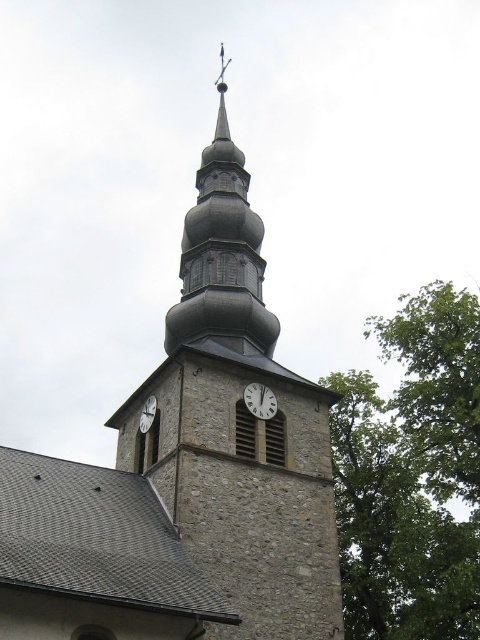
Question: Is stone clock tower at center below green leafy tree at upper right?

Choices:
 (A) yes
 (B) no

Answer: (B)

Question: Observing the image, what is the correct spatial positioning of green leafy tree at upper right in reference to white glossy clock at center?

Choices:
 (A) right
 (B) left

Answer: (A)

Question: Which of the following is the closest to the observer?

Choices:
 (A) stone clock tower at center
 (B) white matte clock at center

Answer: (A)

Question: Which object is the closest to the stone clock tower at center?

Choices:
 (A) green leafy tree at upper right
 (B) white glossy clock at center

Answer: (B)

Question: Which object appears closest to the camera in this image?

Choices:
 (A) white matte clock at center
 (B) green leafy tree at upper right
 (C) white glossy clock at center
 (D) stone clock tower at center

Answer: (D)

Question: Does stone clock tower at center have a smaller size compared to green leafy tree at upper right?

Choices:
 (A) no
 (B) yes

Answer: (A)